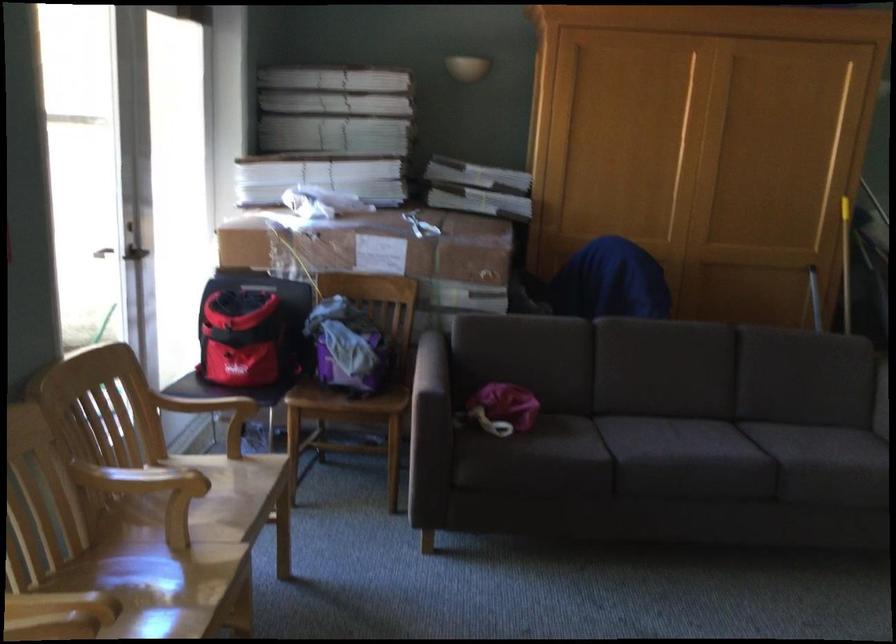
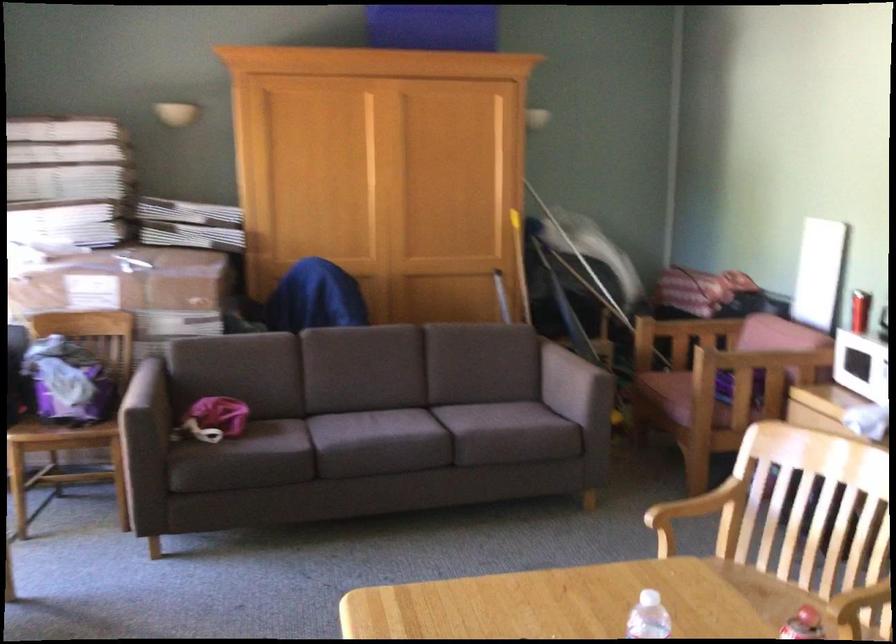
The point at (431, 360) is marked in the first image. Where is the corresponding point in the second image?

(144, 386)